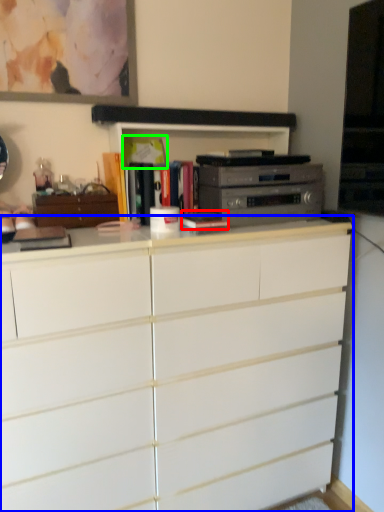
Question: Based on their relative distances, which object is nearer to book (highlighted by a red box)? Choose from chest of drawers (highlighted by a blue box) and book (highlighted by a green box).

Choices:
 (A) chest of drawers
 (B) book

Answer: (B)